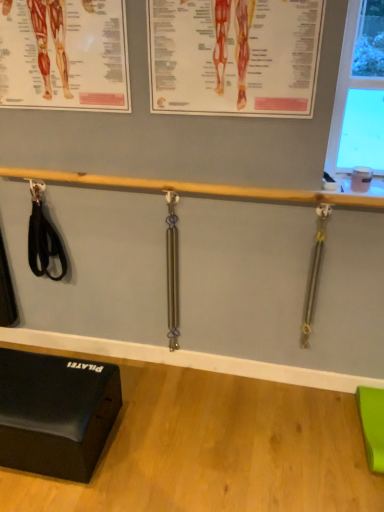
The height and width of the screenshot is (512, 384). I want to click on unoccupied region to the right of black rubber exercise block at lower left, so click(169, 429).